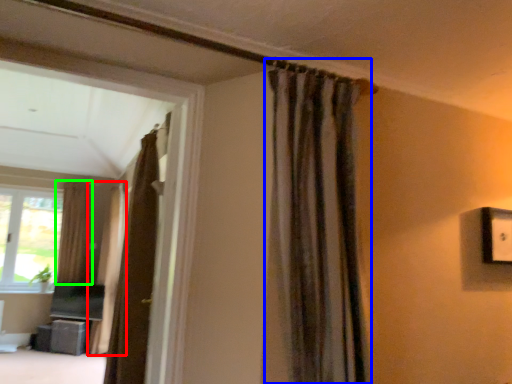
Question: Which object is positioned farthest from curtain (highlighted by a red box)? Select from curtain (highlighted by a blue box) and curtain (highlighted by a green box).

Choices:
 (A) curtain
 (B) curtain

Answer: (A)